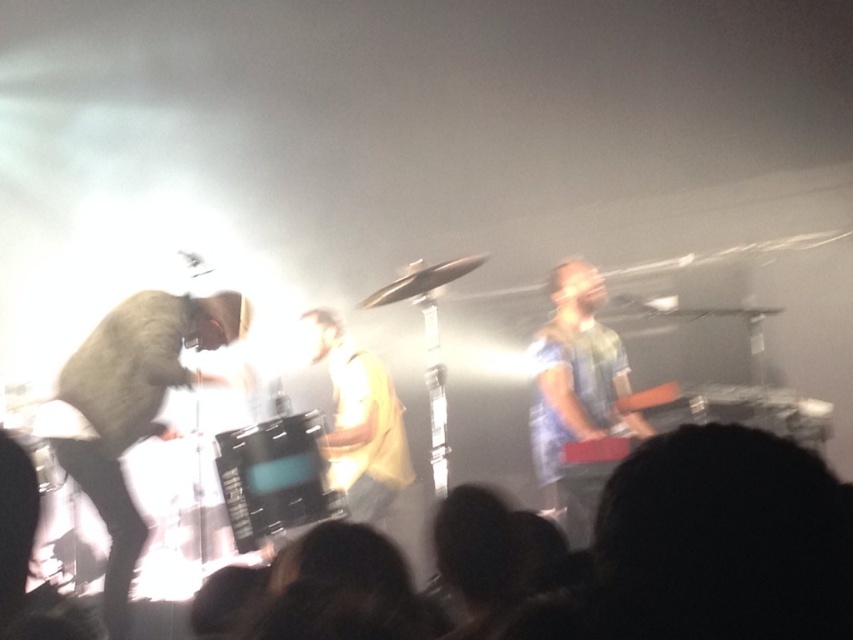
Can you confirm if black hair at lower center is positioned to the left of light brown leather jacket at left?

No, black hair at lower center is not to the left of light brown leather jacket at left.

Who is positioned more to the right, black hair at lower center or light brown leather jacket at left?

black hair at lower center

Locate an element on the screen. This screenshot has height=640, width=853. black hair at lower center is located at coordinates (703, 490).

You are a GUI agent. You are given a task and a screenshot of the screen. Output one action in this format:
    pyautogui.click(x=<x>, y=<y>)
    Task: Click on the black hair at lower center
    This screenshot has height=640, width=853.
    Given the screenshot: What is the action you would take?
    pyautogui.click(x=703, y=490)

This screenshot has height=640, width=853. Find the location of `black hair at lower center`. black hair at lower center is located at coordinates (703, 490).

Based on the photo, which of these two, black hair at lower center or denim shirt at right, stands shorter?

black hair at lower center is shorter.

Locate an element on the screen. The height and width of the screenshot is (640, 853). black hair at lower center is located at coordinates (703, 490).

Describe the element at coordinates (131, 410) in the screenshot. I see `light brown leather jacket at left` at that location.

Is light brown leather jacket at left shorter than denim shirt at right?

Yes.

At what (x,y) coordinates should I click in order to perform the action: click on light brown leather jacket at left. Please return your answer as a coordinate pair (x, y). Image resolution: width=853 pixels, height=640 pixels. Looking at the image, I should click on (131, 410).

Image resolution: width=853 pixels, height=640 pixels. Find the location of `light brown leather jacket at left`. light brown leather jacket at left is located at coordinates (131, 410).